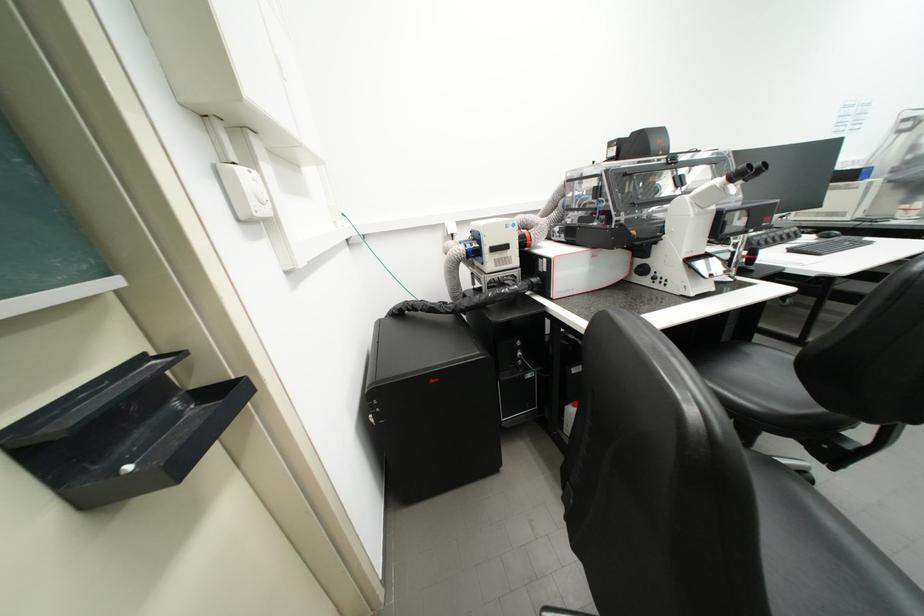
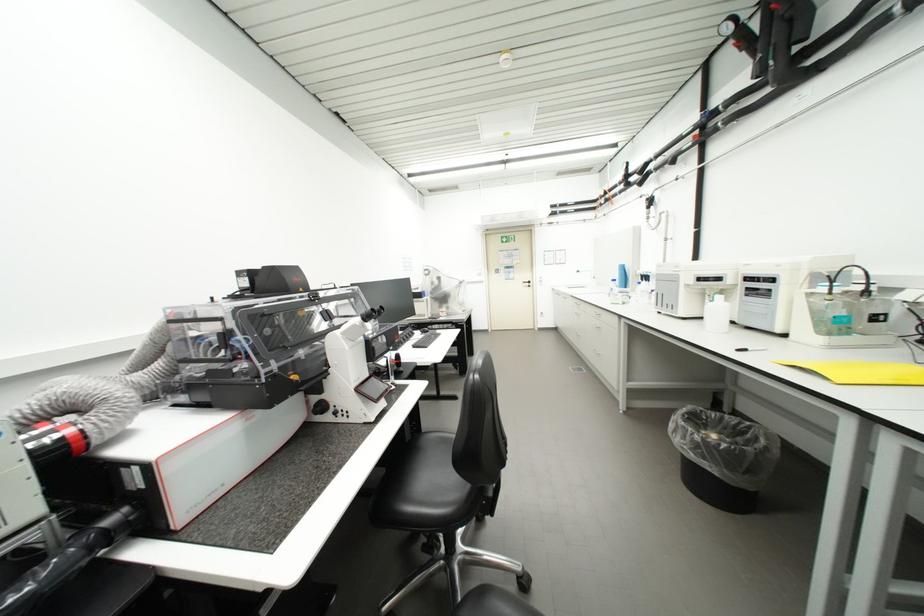
Question: How did the camera likely rotate?

Choices:
 (A) Left
 (B) Right
 (C) Up
 (D) Down

Answer: (B)